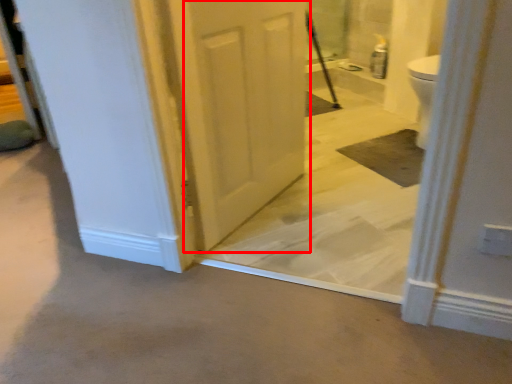
Question: From the image's perspective, what is the correct spatial relationship of door (annotated by the red box) in relation to concrete?

Choices:
 (A) below
 (B) above

Answer: (B)